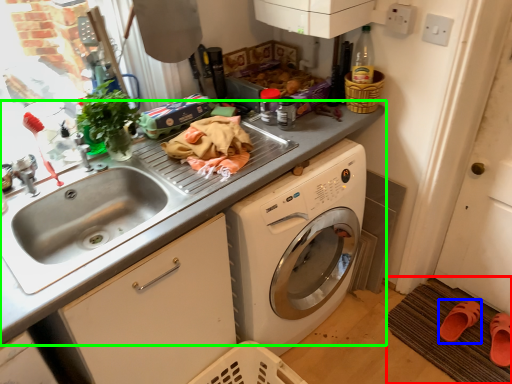
Question: Estimate the real-world distances between objects in this image. Which object is farther from doormat (highlighted by a red box), shoe (highlighted by a blue box) or countertop (highlighted by a green box)?

Choices:
 (A) shoe
 (B) countertop

Answer: (B)